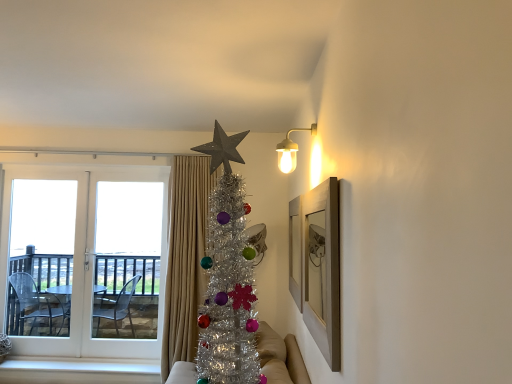
What do you see at coordinates (79, 366) in the screenshot? I see `white wood at lower left` at bounding box center [79, 366].

This screenshot has height=384, width=512. What do you see at coordinates (121, 258) in the screenshot? I see `white glass door at left, which ranks as the second screen door in left-to-right order` at bounding box center [121, 258].

Where is `white wood at lower left`? This screenshot has width=512, height=384. white wood at lower left is located at coordinates (79, 366).

Does white glass door at left have a greater width compared to wooden picture frame at upper right?

Yes, white glass door at left is wider than wooden picture frame at upper right.

This screenshot has width=512, height=384. In order to click on window on the left of wooden picture frame at upper right in this screenshot , I will do `click(86, 258)`.

Who is taller, white glass door at left or wooden picture frame at upper right?

Standing taller between the two is white glass door at left.

Considering the sizes of objects white wood at lower left and white glass door at left, which ranks as the second screen door in left-to-right order, in the image provided, who is wider, white wood at lower left or white glass door at left, which ranks as the second screen door in left-to-right order,?

white wood at lower left.

From the image's perspective, which object appears higher, white wood at lower left or white glass door at left, which is the first screen door from right to left?

white glass door at left, which is the first screen door from right to left, appears higher in the image.

In the scene shown: Based on their positions, is white wood at lower left located to the left or right of white glass door at left, which is the first screen door from right to left?

Based on their positions, white wood at lower left is located to the left of white glass door at left, which is the first screen door from right to left.

Is white wood at lower left in front of or behind white glass door at left, which is the first screen door from right to left, in the image?

Clearly, white wood at lower left is in front of white glass door at left, which is the first screen door from right to left.

Looking at this image, who is bigger, white glass door at left or beige fabric curtain at center?

beige fabric curtain at center is bigger.

In the scene shown: Does white glass door at left turn towards beige fabric curtain at center?

No, white glass door at left is not turned towards beige fabric curtain at center.

Which object is closer to the camera taking this photo, white glass door at left or beige fabric curtain at center?

beige fabric curtain at center.

Identify the location of window that is above the beige fabric curtain at center (from a real-world perspective). (86, 258).

Are transparent plastic screen door at left, the 2th screen door when ordered from right to left, and white glass door at left located far from each other?

No, there isn't a large distance between transparent plastic screen door at left, the 2th screen door when ordered from right to left, and white glass door at left.

Considering the sizes of objects transparent plastic screen door at left, placed as the first screen door when sorted from left to right, and white glass door at left in the image provided, who is wider, transparent plastic screen door at left, placed as the first screen door when sorted from left to right, or white glass door at left?

With larger width is transparent plastic screen door at left, placed as the first screen door when sorted from left to right.

Is transparent plastic screen door at left, the 2th screen door when ordered from right to left, taller or shorter than white glass door at left?

transparent plastic screen door at left, the 2th screen door when ordered from right to left, is shorter than white glass door at left.

Is point (46, 256) closer or farther from the camera than point (62, 364)?

Point (46, 256) is positioned farther from the camera compared to point (62, 364).

Could you tell me if transparent plastic screen door at left, the 2th screen door when ordered from right to left, is turned towards white wood at lower left?

No, transparent plastic screen door at left, the 2th screen door when ordered from right to left, is not turned towards white wood at lower left.

Which object is more forward, transparent plastic screen door at left, the 2th screen door when ordered from right to left, or white wood at lower left?

white wood at lower left is more forward.

Could you measure the distance between transparent plastic screen door at left, the 2th screen door when ordered from right to left, and white wood at lower left?

transparent plastic screen door at left, the 2th screen door when ordered from right to left, is 32.23 inches from white wood at lower left.

Is wooden picture frame at upper right behind transparent plastic screen door at left, the 2th screen door when ordered from right to left?

No, wooden picture frame at upper right is closer to the camera.

From a real-world perspective, is wooden picture frame at upper right positioned over transparent plastic screen door at left, the 2th screen door when ordered from right to left, based on gravity?

Correct, in the physical world, wooden picture frame at upper right is higher than transparent plastic screen door at left, the 2th screen door when ordered from right to left.

Considering the relative positions of wooden picture frame at upper right and transparent plastic screen door at left, placed as the first screen door when sorted from left to right, in the image provided, is wooden picture frame at upper right to the left of transparent plastic screen door at left, placed as the first screen door when sorted from left to right, from the viewer's perspective?

No, wooden picture frame at upper right is not to the left of transparent plastic screen door at left, placed as the first screen door when sorted from left to right.

Does wooden picture frame at upper right have a lesser width compared to transparent plastic screen door at left, placed as the first screen door when sorted from left to right?

Correct, the width of wooden picture frame at upper right is less than that of transparent plastic screen door at left, placed as the first screen door when sorted from left to right.

Is white glass door at left, which ranks as the second screen door in left-to-right order, smaller than wooden picture frame at upper right?

No.

Could you tell me if white glass door at left, which ranks as the second screen door in left-to-right order, is facing wooden picture frame at upper right?

No, white glass door at left, which ranks as the second screen door in left-to-right order, does not turn towards wooden picture frame at upper right.

Can you tell me how much white glass door at left, which ranks as the second screen door in left-to-right order, and wooden picture frame at upper right differ in facing direction?

white glass door at left, which ranks as the second screen door in left-to-right order, and wooden picture frame at upper right are facing 89.3 degrees away from each other.

Is white glass door at left, which is the first screen door from right to left, touching wooden picture frame at upper right?

No, white glass door at left, which is the first screen door from right to left, is not next to wooden picture frame at upper right.

Locate an element on the screen. The width and height of the screenshot is (512, 384). window below the wooden picture frame at upper right (from a real-world perspective) is located at coordinates (86, 258).

Image resolution: width=512 pixels, height=384 pixels. There is a white wood at lower left. What are the coordinates of `the 1st screen door above it (from the image's perspective)` in the screenshot? It's located at (121, 258).

From the image, which object appears to be nearer to wooden picture frame at upper right, beige fabric curtain at center or transparent plastic screen door at left, the 2th screen door when ordered from right to left?

Based on the image, beige fabric curtain at center appears to be nearer to wooden picture frame at upper right.

Which object lies further to the anchor point transparent plastic screen door at left, the 2th screen door when ordered from right to left, wooden picture frame at upper right or white glass door at left?

The object further to transparent plastic screen door at left, the 2th screen door when ordered from right to left, is wooden picture frame at upper right.

Considering their positions, is beige fabric curtain at center positioned closer to white glass door at left than white glass door at left, which is the first screen door from right to left?

white glass door at left, which is the first screen door from right to left.

Based on their spatial positions, is white glass door at left or metallic fabric couch at center closer to beige fabric curtain at center?

white glass door at left lies closer to beige fabric curtain at center than the other object.

Considering their positions, is white glass door at left positioned closer to white wood at lower left than transparent plastic screen door at left, placed as the first screen door when sorted from left to right?

white glass door at left.

Looking at the image, which one is located further to wooden picture frame at upper right, metallic fabric couch at center or white wood at lower left?

white wood at lower left lies further to wooden picture frame at upper right than the other object.

Considering their positions, is beige fabric curtain at center positioned closer to wooden picture frame at upper right than metallic fabric couch at center?

metallic fabric couch at center is closer to wooden picture frame at upper right.

Looking at the image, which one is located further to white wood at lower left, white glass door at left or white glass door at left, which is the first screen door from right to left?

white glass door at left is positioned further to the anchor white wood at lower left.

This screenshot has width=512, height=384. What are the coordinates of `window located between transparent plastic screen door at left, the 2th screen door when ordered from right to left, and beige fabric curtain at center in the left-right direction` in the screenshot? It's located at (86, 258).

Locate an element on the screen. The width and height of the screenshot is (512, 384). studio couch between wooden picture frame at upper right and transparent plastic screen door at left, the 2th screen door when ordered from right to left, from front to back is located at coordinates (280, 357).

This screenshot has width=512, height=384. Identify the location of curtain between metallic fabric couch at center and transparent plastic screen door at left, the 2th screen door when ordered from right to left, from front to back. (185, 257).

What are the coordinates of `window sill located between wooden picture frame at upper right and white glass door at left in the depth direction` in the screenshot? It's located at [79, 366].